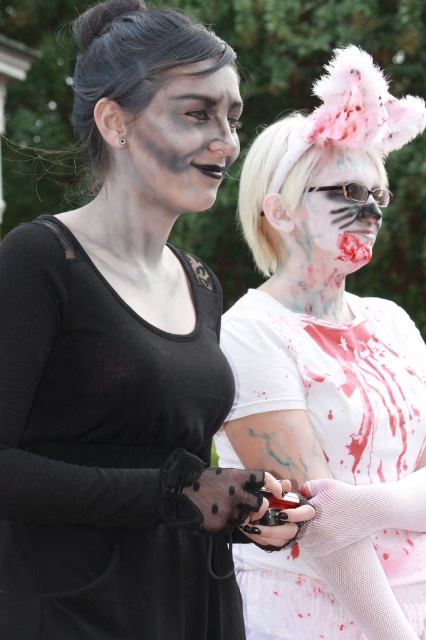
Does white mesh glove at right have a smaller size compared to white matte face paint at center?

Actually, white mesh glove at right might be larger than white matte face paint at center.

Is white mesh glove at right below white matte face paint at center?

Yes.

What do you see at coordinates (330, 371) in the screenshot?
I see `white mesh glove at right` at bounding box center [330, 371].

You are a GUI agent. You are given a task and a screenshot of the screen. Output one action in this format:
    pyautogui.click(x=<x>, y=<y>)
    Task: Click on the white mesh glove at right
    This screenshot has height=640, width=426.
    Given the screenshot: What is the action you would take?
    pyautogui.click(x=330, y=371)

Can you confirm if white mesh glove at right is thinner than matte black face paint at center?

Incorrect, white mesh glove at right's width is not less than matte black face paint at center's.

Describe the element at coordinates (330, 371) in the screenshot. This screenshot has width=426, height=640. I see `white mesh glove at right` at that location.

The image size is (426, 640). I want to click on white mesh glove at right, so click(330, 371).

How distant is matte black dress at center from matte black face paint at center?

matte black dress at center and matte black face paint at center are 11.83 inches apart.

Locate an element on the screen. Image resolution: width=426 pixels, height=640 pixels. matte black dress at center is located at coordinates (126, 358).

Who is more forward, (129, 81) or (164, 134)?

Point (129, 81) is more forward.

In order to click on matte black dress at center in this screenshot , I will do `click(126, 358)`.